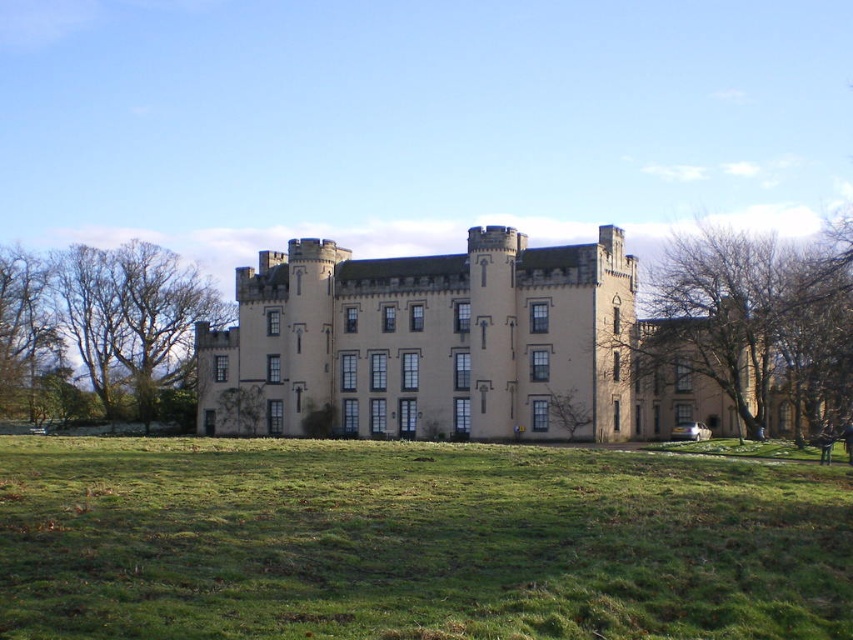
Which is more to the left, beige stone castle at center or bare branches at right?

beige stone castle at center is more to the left.

Find the location of a particular element. Image resolution: width=853 pixels, height=640 pixels. beige stone castle at center is located at coordinates (426, 342).

Which is in front, point (340, 296) or point (813, 300)?

Point (813, 300) is more forward.

Where is `beige stone castle at center`? This screenshot has width=853, height=640. beige stone castle at center is located at coordinates (426, 342).

Identify the location of green grass at center. The image size is (853, 640). pos(415,541).

Is green grass at center taller than bare branches at left?

Incorrect, green grass at center's height is not larger of bare branches at left's.

The height and width of the screenshot is (640, 853). I want to click on green grass at center, so click(415, 541).

Where is `green grass at center`? green grass at center is located at coordinates (415, 541).

Between bare branches at right and bare branches at left, which one has more height?

Standing taller between the two is bare branches at right.

Which is behind, point (735, 401) or point (151, 260)?

Point (151, 260)

Locate an element on the screen. This screenshot has width=853, height=640. bare branches at right is located at coordinates click(x=753, y=324).